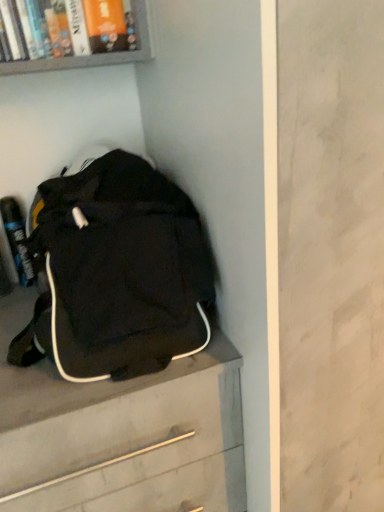
Question: Should I look upward or downward to see black fabric chest of drawers at lower left?

Choices:
 (A) up
 (B) down

Answer: (B)

Question: Is black fabric chest of drawers at lower left aimed at black fabric backpack at lower left?

Choices:
 (A) no
 (B) yes

Answer: (A)

Question: Is black fabric chest of drawers at lower left positioned far away from black fabric backpack at lower left?

Choices:
 (A) yes
 (B) no

Answer: (B)

Question: Is black fabric chest of drawers at lower left further to camera compared to black fabric backpack at lower left?

Choices:
 (A) no
 (B) yes

Answer: (B)

Question: Considering the relative sizes of black fabric chest of drawers at lower left and black fabric backpack at lower left in the image provided, is black fabric chest of drawers at lower left taller than black fabric backpack at lower left?

Choices:
 (A) no
 (B) yes

Answer: (B)

Question: Does black fabric chest of drawers at lower left appear on the left side of black fabric backpack at lower left?

Choices:
 (A) no
 (B) yes

Answer: (B)

Question: Can you confirm if black fabric chest of drawers at lower left is shorter than black fabric backpack at lower left?

Choices:
 (A) no
 (B) yes

Answer: (A)

Question: From a real-world perspective, is black fabric backpack at lower left positioned over black fabric chest of drawers at lower left based on gravity?

Choices:
 (A) yes
 (B) no

Answer: (A)

Question: Does black fabric backpack at lower left have a greater height compared to black fabric chest of drawers at lower left?

Choices:
 (A) yes
 (B) no

Answer: (B)

Question: From the image's perspective, is black fabric backpack at lower left on top of black fabric chest of drawers at lower left?

Choices:
 (A) yes
 (B) no

Answer: (A)

Question: Is black fabric backpack at lower left facing away from black fabric chest of drawers at lower left?

Choices:
 (A) yes
 (B) no

Answer: (B)

Question: Is black fabric backpack at lower left bigger than black fabric chest of drawers at lower left?

Choices:
 (A) no
 (B) yes

Answer: (A)

Question: Considering the relative sizes of black fabric backpack at lower left and black fabric chest of drawers at lower left in the image provided, is black fabric backpack at lower left thinner than black fabric chest of drawers at lower left?

Choices:
 (A) no
 (B) yes

Answer: (B)

Question: From a real-world perspective, is black fabric backpack at lower left above or below black fabric chest of drawers at lower left?

Choices:
 (A) above
 (B) below

Answer: (A)